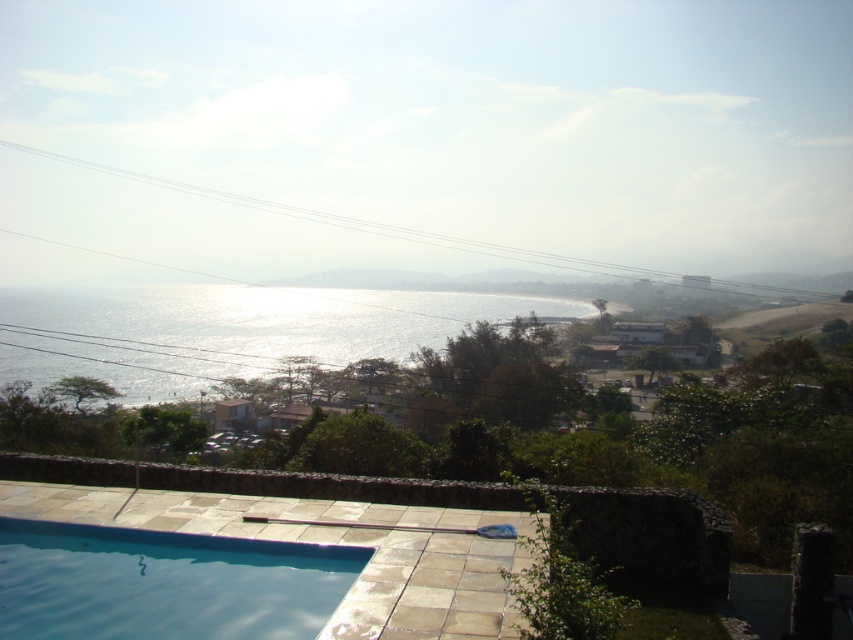
You are a landscape architect designing a new garden. You want to place a statue between the shiny metallic water at center and the clear glass pool at lower left. Which object should the statue be closer to if you want it to appear visually balanced given their sizes?

The shiny metallic water at center is much taller than the clear glass pool at lower left, so the statue should be placed closer to the clear glass pool at lower left to achieve visual balance.